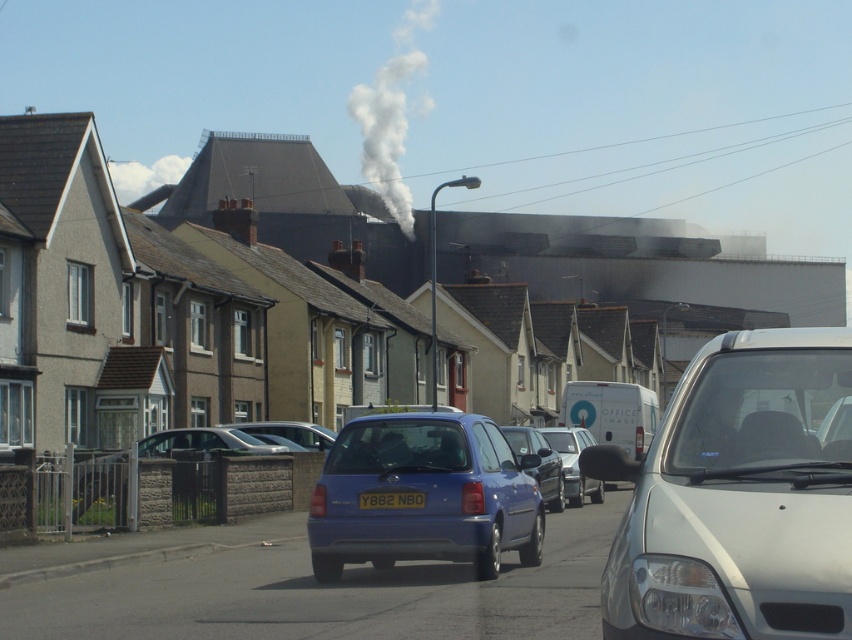
Question: Does silver metallic van at center have a lesser width compared to black plastic license plate at center?

Choices:
 (A) yes
 (B) no

Answer: (A)

Question: Based on their relative distances, which object is nearer to the matte blue hatchback at center?

Choices:
 (A) white smoke at center
 (B) silver metallic van at right
 (C) matte blue car at center

Answer: (B)

Question: Which of these objects is positioned farthest from the silver metallic van at right?

Choices:
 (A) matte blue car at center
 (B) white smoke at center

Answer: (B)

Question: Is silver metallic van at right thinner than white smoke at center?

Choices:
 (A) yes
 (B) no

Answer: (A)

Question: Which of the following is the farthest from the observer?

Choices:
 (A) matte blue hatchback at center
 (B) black plastic license plate at center

Answer: (B)

Question: Is matte blue car at center to the right of black plastic license plate at center from the viewer's perspective?

Choices:
 (A) yes
 (B) no

Answer: (A)